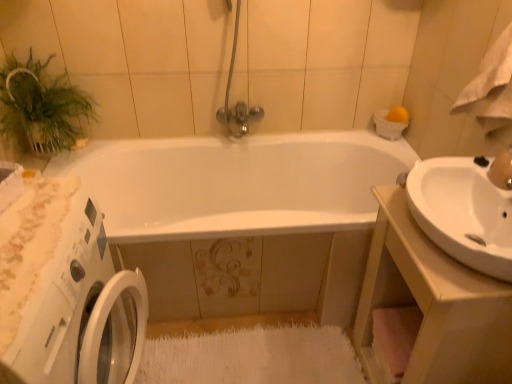
Locate an element on the screen. free space above white glossy washing machine at left (from a real-world perspective) is located at coordinates (32, 231).